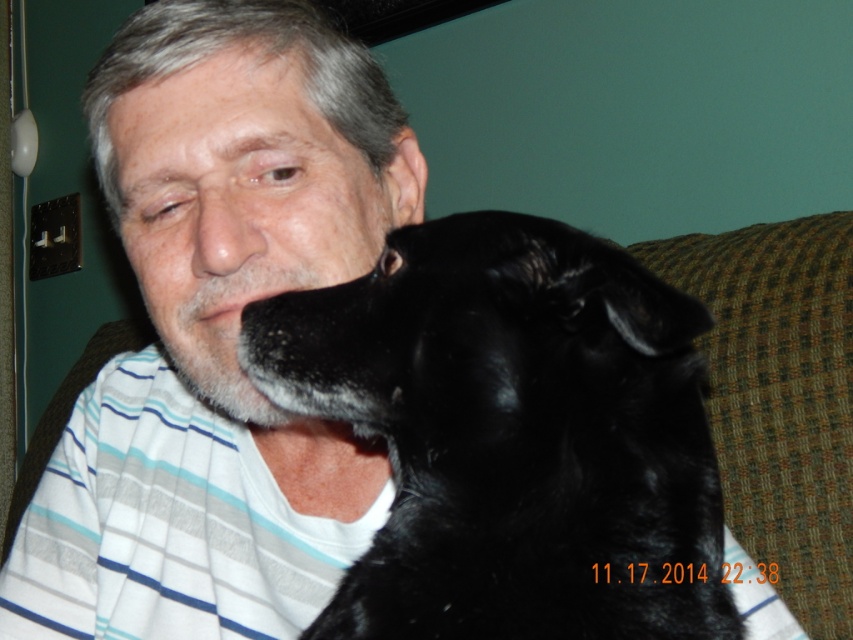
Based on the scene description, can you determine the spatial relationship between the black fur dog at left and the matte black face at center? Specifically, is the dog positioned above or below the face?

The black fur dog at left is below matte black face at center, so the dog is positioned below the face.

You are an interior designer analyzing the spatial arrangement of furniture in the room. You notice two points marked in the image. The first point is at coordinate point(567, 372) and the second is at point(167, 150). Based on their positions, which point is closer to the viewer?

Point(567, 372) is in front of point(167, 150), so it is closer to the viewer.

You are a photographer trying to capture the black fur dog at left and the matte black face at center in a single frame. Which object should you focus on first if you want to ensure both are in focus?

The black fur dog at left is not as tall as matte black face at center, so you should focus on the matte black face at center first to ensure both are in focus.